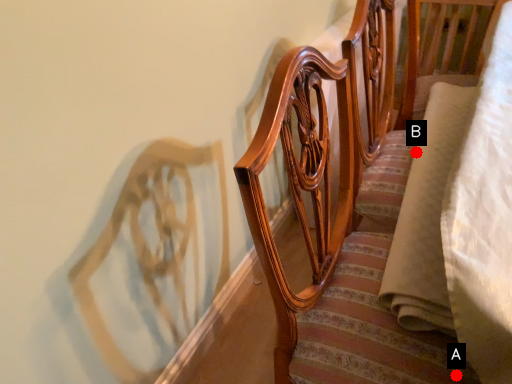
Question: Two points are circled on the image, labeled by A and B beside each circle. Which point appears closest to the camera in this image?

Choices:
 (A) A is closer
 (B) B is closer

Answer: (A)